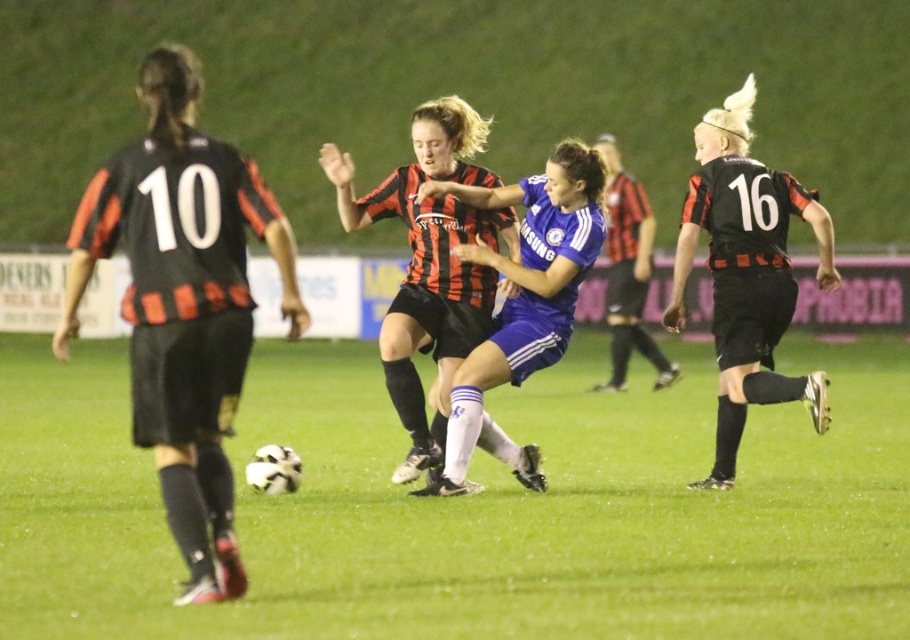
Between matte black jersey at center and blue jersey at center, which one is positioned lower?

blue jersey at center

Is point (446, 397) closer to camera compared to point (532, 177)?

Yes, it is in front of point (532, 177).

Is point (498, 429) behind point (446, 444)?

Yes, point (498, 429) is farther from viewer.

The width and height of the screenshot is (910, 640). I want to click on matte black jersey at center, so click(x=430, y=264).

Is the position of green grass football field at center more distant than that of blue jersey at center?

That is False.

Who is more distant from viewer, (x=114, y=612) or (x=452, y=438)?

The point (x=452, y=438) is behind.

You are a GUI agent. You are given a task and a screenshot of the screen. Output one action in this format:
    pyautogui.click(x=<x>, y=<y>)
    Task: Click on the green grass football field at center
    
    Given the screenshot: What is the action you would take?
    pyautogui.click(x=468, y=508)

Find the location of a particular element. green grass football field at center is located at coordinates (468, 508).

In the scene shown: Who is positioned more to the left, green grass football field at center or matte black jersey at center?

green grass football field at center is more to the left.

Is green grass football field at center positioned before matte black jersey at center?

Yes, green grass football field at center is in front of matte black jersey at center.

Describe the element at coordinates (468, 508) in the screenshot. I see `green grass football field at center` at that location.

Find the location of a particular element. The image size is (910, 640). green grass football field at center is located at coordinates (468, 508).